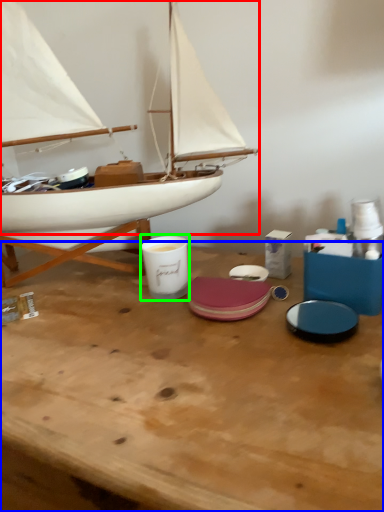
Question: Which object is positioned closest to boat (highlighted by a red box)? Select from table (highlighted by a blue box) and tableware (highlighted by a green box).

Choices:
 (A) table
 (B) tableware

Answer: (B)